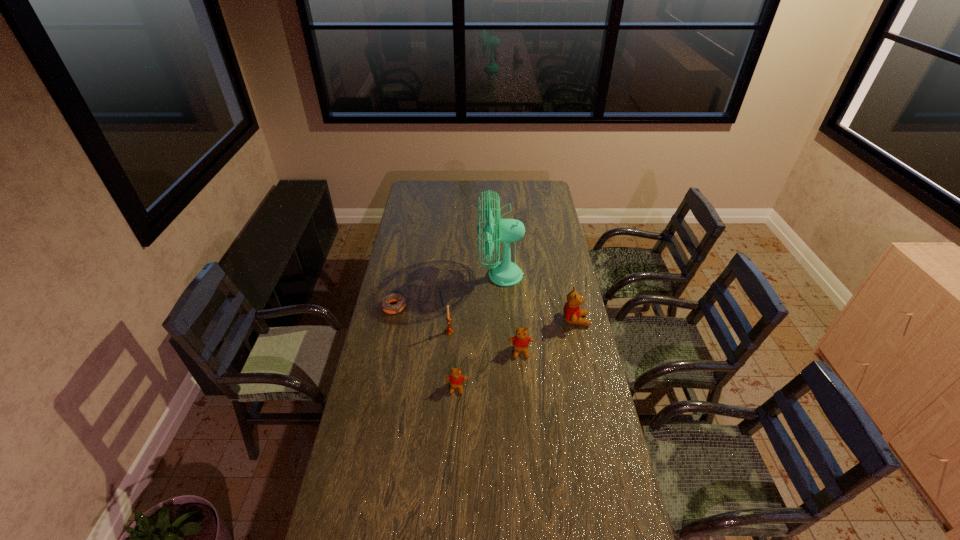
The height and width of the screenshot is (540, 960). In order to click on free spot between the fifth farthest object and the candle_holder in this screenshot , I will do `click(485, 341)`.

What are the coordinates of `free space between the fan and the shortest object` in the screenshot? It's located at (447, 291).

You are a GUI agent. You are given a task and a screenshot of the screen. Output one action in this format:
    pyautogui.click(x=<x>, y=<y>)
    Task: Click on the empty location between the second nearest teddy bear and the second shortest object
    This screenshot has height=540, width=960.
    Given the screenshot: What is the action you would take?
    pyautogui.click(x=489, y=369)

Find the location of `object that is the second closest to the leftmost object`. object that is the second closest to the leftmost object is located at coordinates (505, 273).

The height and width of the screenshot is (540, 960). Identify the location of object that is the closest to the tallest object. (572, 313).

Where is `teddy bear that is the third closest one to the candle_holder`? This screenshot has height=540, width=960. teddy bear that is the third closest one to the candle_holder is located at coordinates (572, 313).

The width and height of the screenshot is (960, 540). In order to click on the closest teddy bear relative to the second teddy bear from right to left in this screenshot , I will do `click(572, 313)`.

At what (x,y) coordinates should I click in order to perform the action: click on vacant point that satisfies the following two spatial constraints: 1. in front of the tallest object to blow air; 2. on the front-facing side of the shortest teddy bear. Please return your answer as a coordinate pair (x, y). Image resolution: width=960 pixels, height=540 pixels. Looking at the image, I should click on (506, 388).

At what (x,y) coordinates should I click in order to perform the action: click on free spot that satisfies the following two spatial constraints: 1. on the front-facing side of the rightmost teddy bear; 2. on the front-facing side of the leftmost teddy bear. Please return your answer as a coordinate pair (x, y). The image size is (960, 540). Looking at the image, I should click on (591, 388).